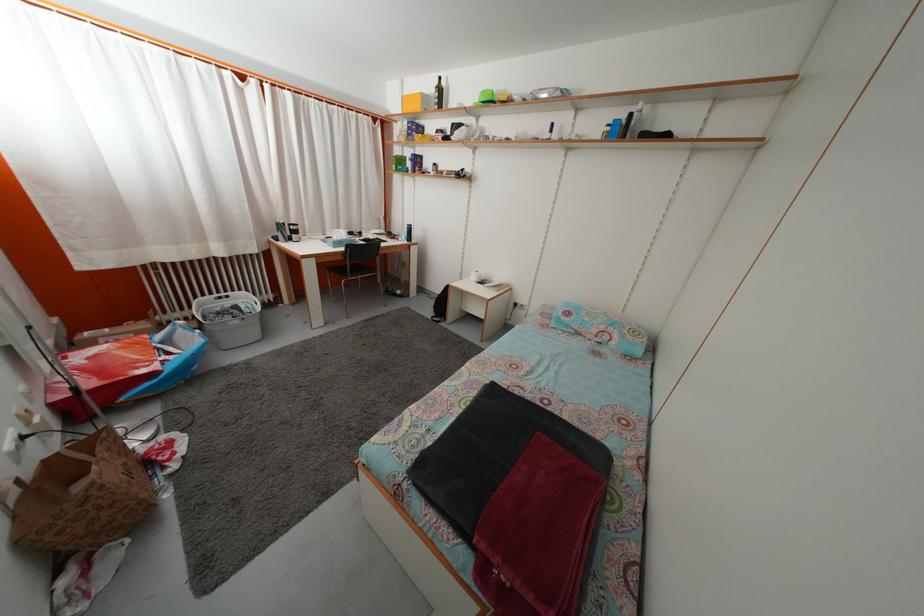
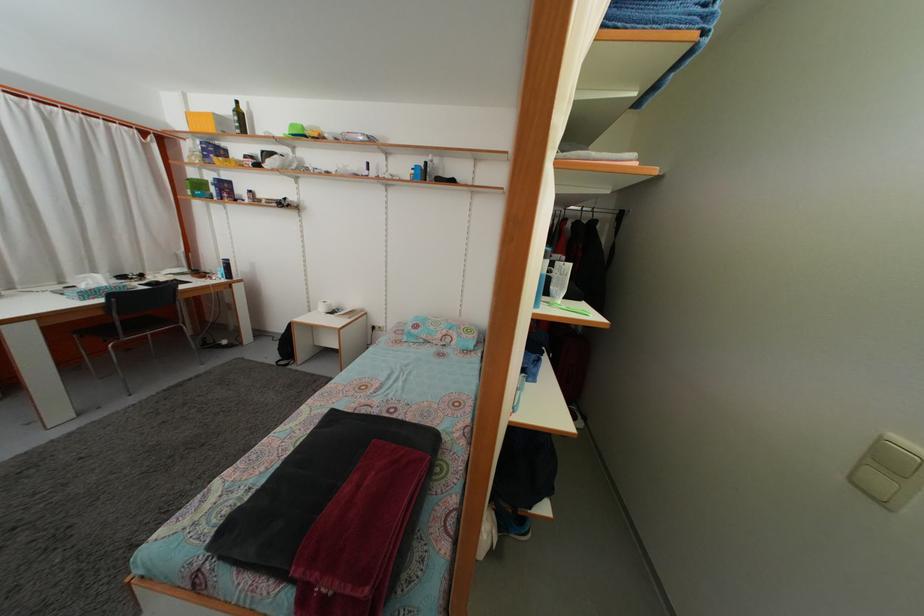
Locate, in the second image, the point that corresponds to point 489,100 in the first image.

(298, 132)